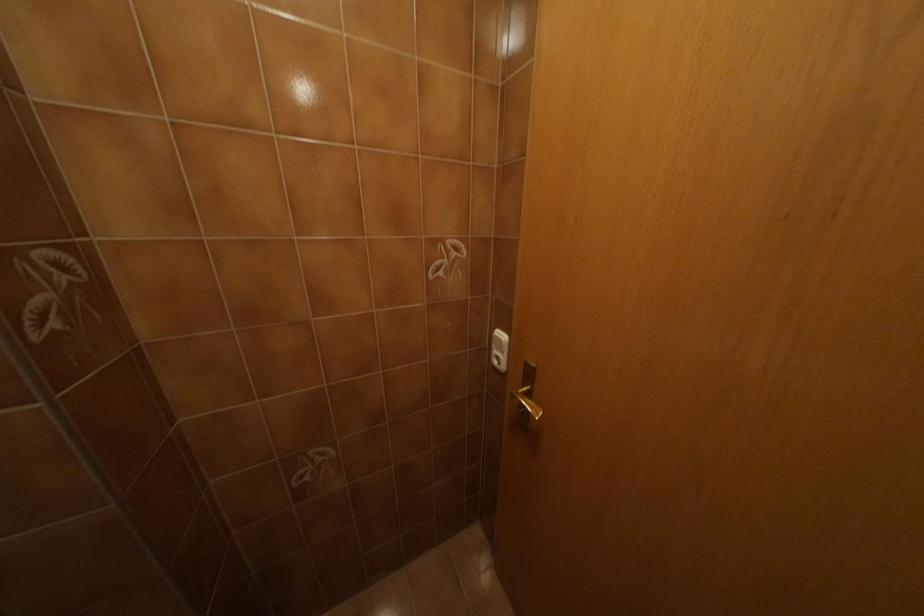
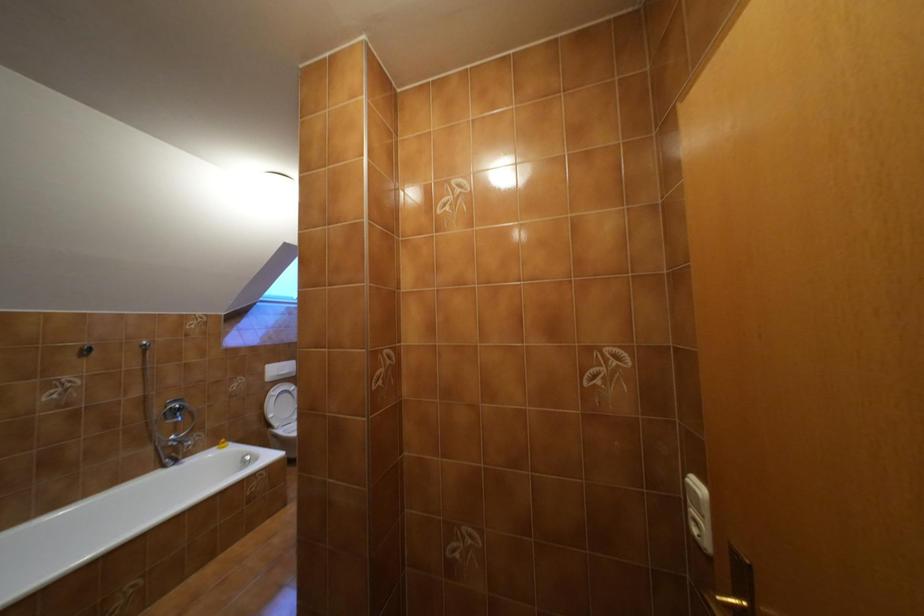
The first image is from the beginning of the video and the second image is from the end. How did the camera likely rotate when shooting the video?

The rotation direction of the camera is left-up.